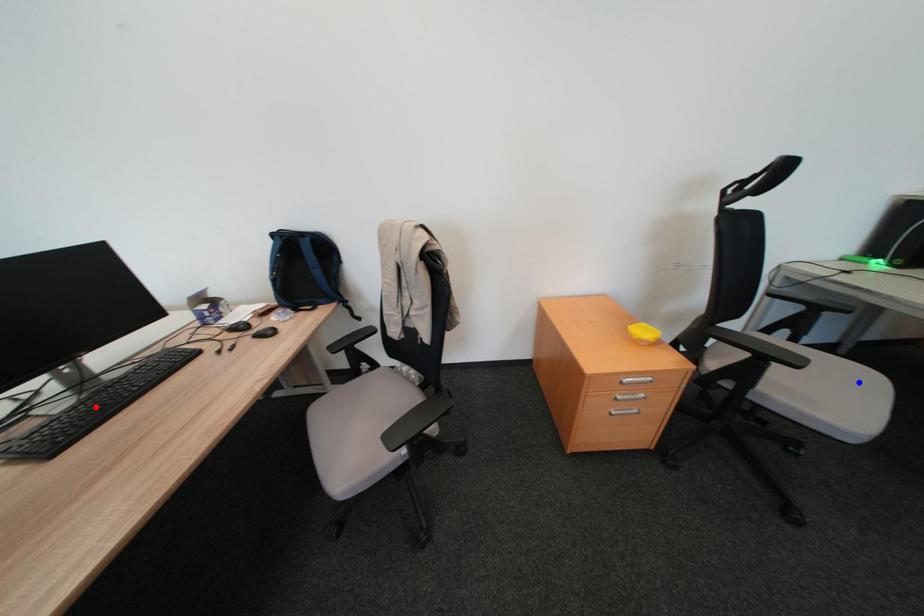
Question: In the image, two points are highlighted. Which point is nearer to the camera? Reply with the corresponding letter.

Choices:
 (A) blue point
 (B) red point

Answer: (B)